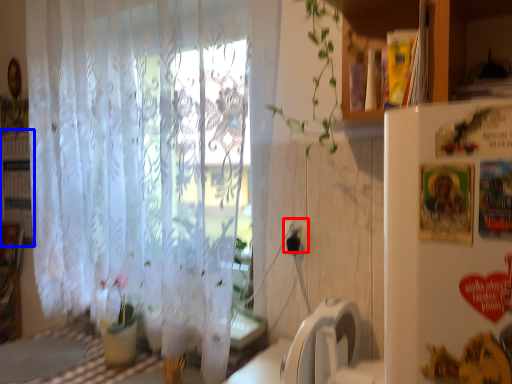
Question: Which of the following is the closest to the observer, electric outlet (highlighted by a red box) or bookshelf (highlighted by a blue box)?

Choices:
 (A) electric outlet
 (B) bookshelf

Answer: (A)